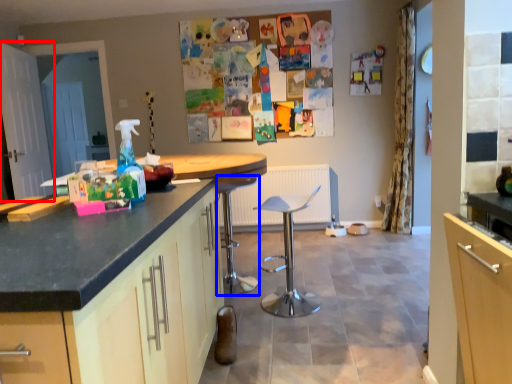
Question: Which object appears farthest to the camera in this image, screen door (highlighted by a red box) or bar stool (highlighted by a blue box)?

Choices:
 (A) screen door
 (B) bar stool

Answer: (A)